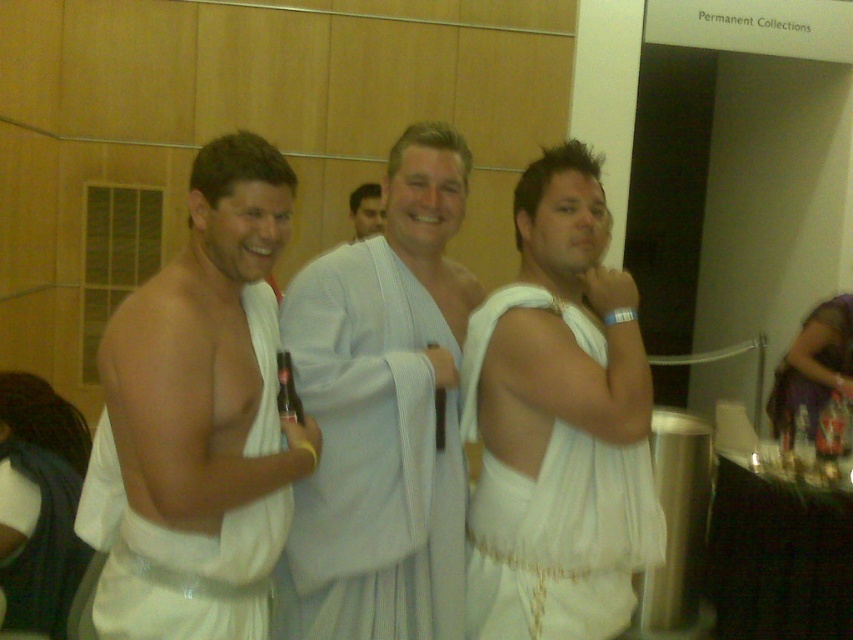
Question: Based on their relative distances, which object is nearer to the muscle at center?

Choices:
 (A) white cloth toga at left
 (B) white fabric toga at center
 (C) white cotton toga at center
 (D) white cloth toga at center

Answer: (A)

Question: Is white cloth toga at left closer to camera compared to white fabric toga at center?

Choices:
 (A) yes
 (B) no

Answer: (A)

Question: Can you confirm if white cotton toga at center is bigger than muscle at center?

Choices:
 (A) yes
 (B) no

Answer: (A)

Question: Which point is farther from the camera taking this photo?

Choices:
 (A) (440, 524)
 (B) (587, 608)
 (C) (277, 474)

Answer: (A)

Question: Does white fabric toga at center appear under white cloth toga at center?

Choices:
 (A) yes
 (B) no

Answer: (A)

Question: Which of the following is the closest to the observer?

Choices:
 (A) (244, 531)
 (B) (648, 538)
 (C) (352, 212)

Answer: (A)